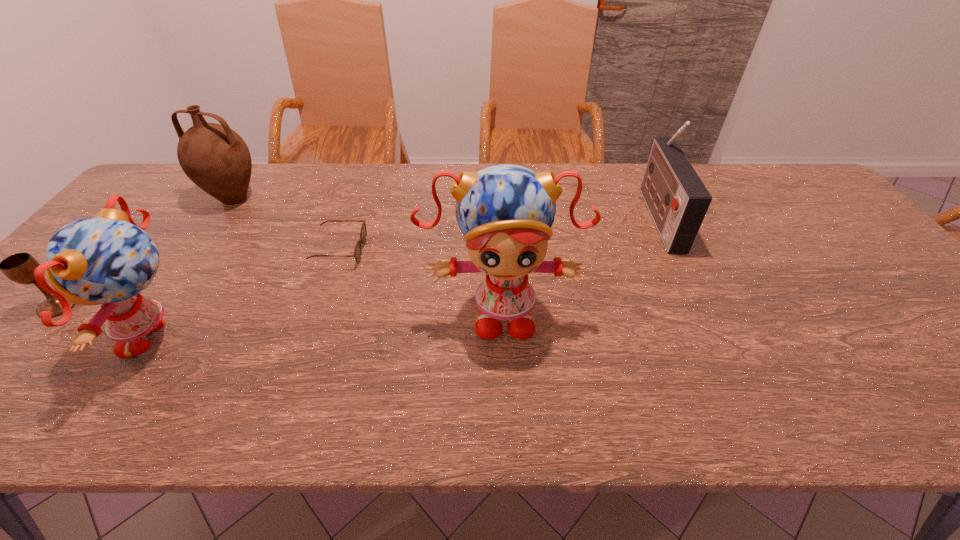
The height and width of the screenshot is (540, 960). What are the coordinates of `blank space located on the face of the shorter doll` in the screenshot? It's located at click(x=43, y=337).

Where is `vacant region located on the face of the shorter doll`? vacant region located on the face of the shorter doll is located at coordinates (16, 337).

At what (x,y) coordinates should I click in order to perform the action: click on vacant position located on the front panel of the rightmost object. Please return your answer as a coordinate pair (x, y). This screenshot has width=960, height=540. Looking at the image, I should click on (539, 216).

The image size is (960, 540). I want to click on free space located on the front panel of the rightmost object, so click(613, 216).

The width and height of the screenshot is (960, 540). What are the coordinates of `vacant space situated on the front panel of the rightmost object` in the screenshot? It's located at (518, 216).

The image size is (960, 540). Find the location of `free space located at the front view of the spectacles`. free space located at the front view of the spectacles is located at coordinates (442, 251).

Locate an element on the screen. The image size is (960, 540). free spot located on the left of the pitcher is located at coordinates (147, 198).

Where is `vacant area situated on the right of the chalice`? vacant area situated on the right of the chalice is located at coordinates (121, 306).

I want to click on radio receiver that is at the far edge, so click(677, 199).

You are a GUI agent. You are given a task and a screenshot of the screen. Output one action in this format:
    pyautogui.click(x=<x>, y=<y>)
    Task: Click on the pitcher that is at the far edge
    The width and height of the screenshot is (960, 540).
    Given the screenshot: What is the action you would take?
    pyautogui.click(x=214, y=157)